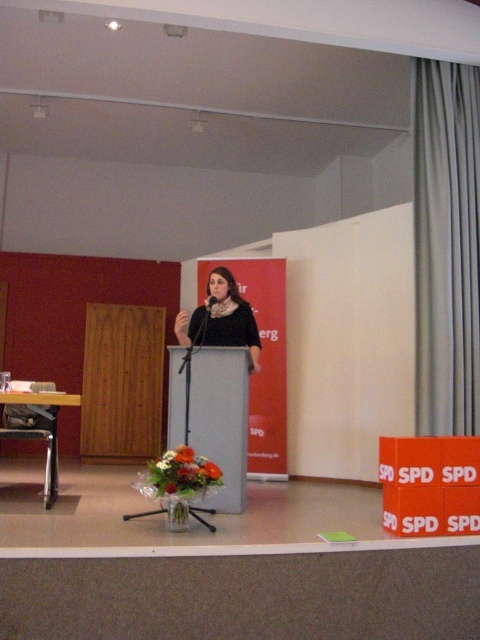
Which is behind, point (232, 392) or point (210, 307)?

The point (210, 307) is more distant.

Is point (212, 497) less distant than point (213, 298)?

That is True.

Image resolution: width=480 pixels, height=640 pixels. What are the coordinates of `matte gray podium at center` in the screenshot? It's located at (220, 419).

Does matte gray podium at center have a greater height compared to black fabric scarf at center?

Indeed, matte gray podium at center has a greater height compared to black fabric scarf at center.

The image size is (480, 640). What do you see at coordinates (220, 419) in the screenshot?
I see `matte gray podium at center` at bounding box center [220, 419].

Between point (228, 388) and point (189, 346), which one is positioned behind?

The point (228, 388) is more distant.

At what (x,y) coordinates should I click in order to perform the action: click on matte gray podium at center. Please return your answer as a coordinate pair (x, y). This screenshot has height=640, width=480. Looking at the image, I should click on (220, 419).

Who is taller, black fabric scarf at center or black matte microphone at center?

black fabric scarf at center

Between point (201, 332) and point (206, 300), which one is positioned in front?

Point (201, 332)

Where is `black fabric scarf at center`? black fabric scarf at center is located at coordinates (220, 317).